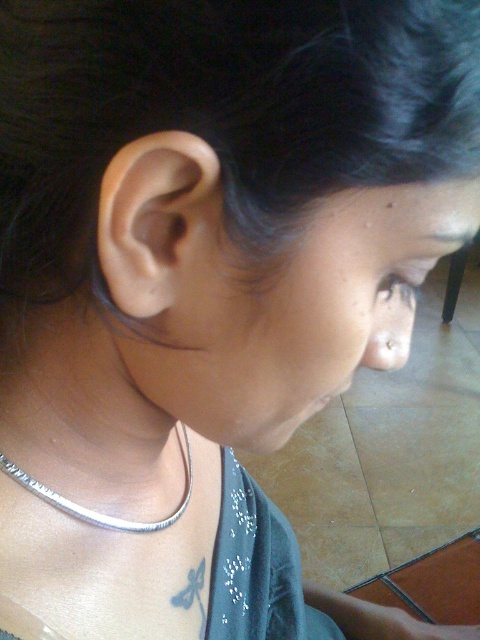
Does silver metallic necklace at center appear on the left side of silver metallic earring at ear?

Indeed, silver metallic necklace at center is positioned on the left side of silver metallic earring at ear.

Is point (148, 433) in front of point (388, 340)?

That is False.

Is point (38, 312) less distant than point (389, 346)?

No, (38, 312) is behind (389, 346).

You are a GUI agent. You are given a task and a screenshot of the screen. Output one action in this format:
    pyautogui.click(x=<x>, y=<y>)
    Task: Click on the silver metallic necklace at center
    This screenshot has height=640, width=480.
    Given the screenshot: What is the action you would take?
    pyautogui.click(x=80, y=403)

Can you confirm if silver/metallic chain at lower center is smaller than silver metallic earring at ear?

No, silver/metallic chain at lower center is not smaller than silver metallic earring at ear.

Describe the element at coordinates (96, 512) in the screenshot. The height and width of the screenshot is (640, 480). I see `silver/metallic chain at lower center` at that location.

Describe the element at coordinates (96, 512) in the screenshot. I see `silver/metallic chain at lower center` at that location.

Locate an element on the screen. The height and width of the screenshot is (640, 480). silver/metallic chain at lower center is located at coordinates (96, 512).

Does natural skin tone ear at center have a greater width compared to silver metallic earring at ear?

Yes.

Which is more to the left, natural skin tone ear at center or silver metallic earring at ear?

natural skin tone ear at center is more to the left.

Who is more forward, (163, 228) or (387, 340)?

Point (163, 228)

You are a GUI agent. You are given a task and a screenshot of the screen. Output one action in this format:
    pyautogui.click(x=<x>, y=<y>)
    Task: Click on the natural skin tone ear at center
    The width and height of the screenshot is (480, 640).
    Given the screenshot: What is the action you would take?
    pyautogui.click(x=155, y=221)